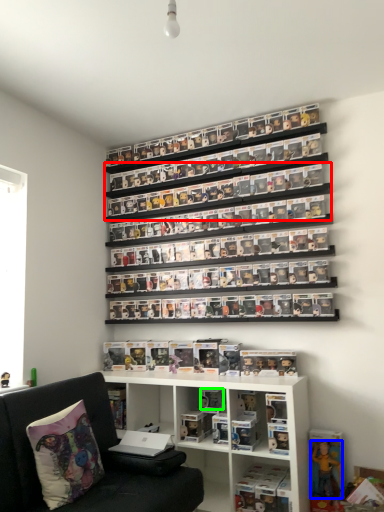
Question: Which object is the closest to the shelf (highlighted by a red box)? Choose among these: toy (highlighted by a blue box) or toy (highlighted by a green box).

Choices:
 (A) toy
 (B) toy

Answer: (B)